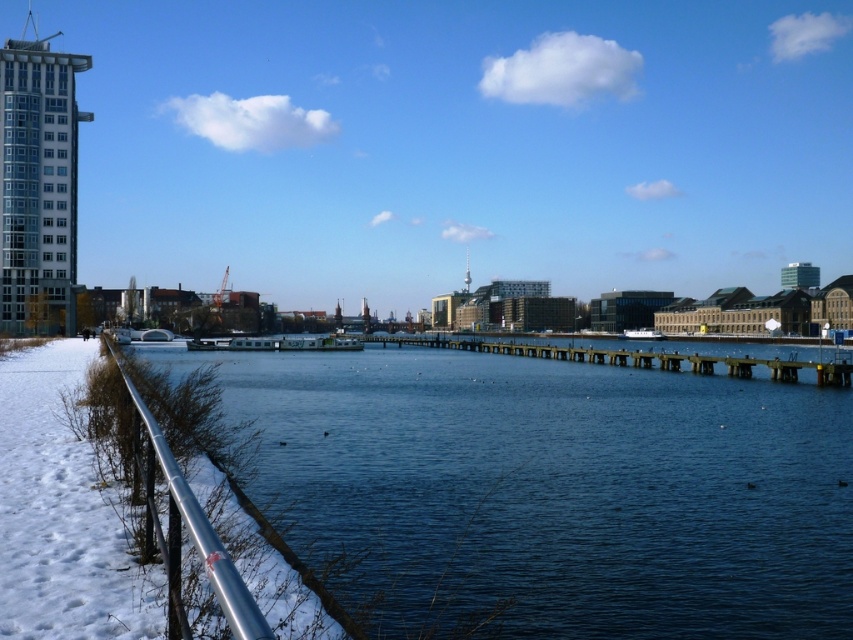
Who is more forward, (x=32, y=42) or (x=653, y=362)?

Point (x=653, y=362) is more forward.

Is glassy reflective skyscraper at upper left positioned behind wooden at center?

Yes.

What do you see at coordinates (38, 184) in the screenshot? I see `glassy reflective skyscraper at upper left` at bounding box center [38, 184].

The width and height of the screenshot is (853, 640). I want to click on glassy reflective skyscraper at upper left, so click(x=38, y=184).

Which is more to the left, blue water at center or wooden at center?

blue water at center is more to the left.

Which is behind, point (759, 576) or point (567, 356)?

Positioned behind is point (567, 356).

Locate an element on the screen. This screenshot has width=853, height=640. blue water at center is located at coordinates tap(550, 492).

I want to click on blue water at center, so click(x=550, y=492).

Can you confirm if blue water at center is positioned to the left of silver metallic rail at left?

No, blue water at center is not to the left of silver metallic rail at left.

Locate an element on the screen. blue water at center is located at coordinates pyautogui.click(x=550, y=492).